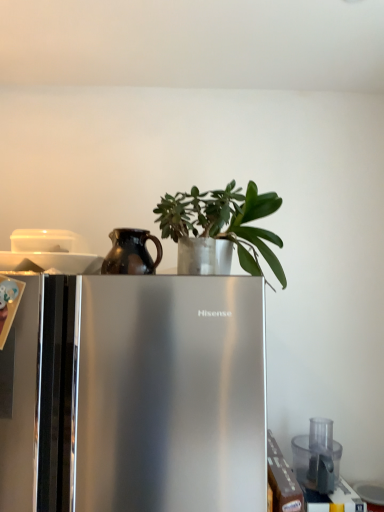
Question: Does transparent plastic food processor at lower right lie in front of green matte plant at center?

Choices:
 (A) no
 (B) yes

Answer: (A)

Question: From a real-world perspective, is transparent plastic food processor at lower right positioned under green matte plant at center based on gravity?

Choices:
 (A) yes
 (B) no

Answer: (A)

Question: Can you confirm if transparent plastic food processor at lower right is thinner than green matte plant at center?

Choices:
 (A) no
 (B) yes

Answer: (A)

Question: Considering the relative sizes of transparent plastic food processor at lower right and green matte plant at center in the image provided, is transparent plastic food processor at lower right bigger than green matte plant at center?

Choices:
 (A) yes
 (B) no

Answer: (B)

Question: Could green matte plant at center be considered to be inside transparent plastic food processor at lower right?

Choices:
 (A) no
 (B) yes

Answer: (A)

Question: Is satin silver refrigerator at center taller or shorter than transparent plastic food processor at lower right?

Choices:
 (A) short
 (B) tall

Answer: (B)

Question: From a real-world perspective, is satin silver refrigerator at center above or below transparent plastic food processor at lower right?

Choices:
 (A) below
 (B) above

Answer: (B)

Question: Considering the positions of satin silver refrigerator at center and transparent plastic food processor at lower right in the image, is satin silver refrigerator at center wider or thinner than transparent plastic food processor at lower right?

Choices:
 (A) thin
 (B) wide

Answer: (B)

Question: Is satin silver refrigerator at center in front of or behind transparent plastic food processor at lower right in the image?

Choices:
 (A) behind
 (B) front

Answer: (B)

Question: Is brown matte jug at upper left inside or outside of satin silver refrigerator at center?

Choices:
 (A) inside
 (B) outside

Answer: (B)

Question: Is brown matte jug at upper left bigger or smaller than satin silver refrigerator at center?

Choices:
 (A) big
 (B) small

Answer: (B)

Question: Is brown matte jug at upper left taller or shorter than satin silver refrigerator at center?

Choices:
 (A) short
 (B) tall

Answer: (A)

Question: In the image, is brown matte jug at upper left on the left side or the right side of satin silver refrigerator at center?

Choices:
 (A) right
 (B) left

Answer: (A)

Question: Which is correct: green matte plant at center is inside brown matte jug at upper left, or outside of it?

Choices:
 (A) outside
 (B) inside

Answer: (A)

Question: Relative to brown matte jug at upper left, is green matte plant at center in front or behind?

Choices:
 (A) front
 (B) behind

Answer: (A)